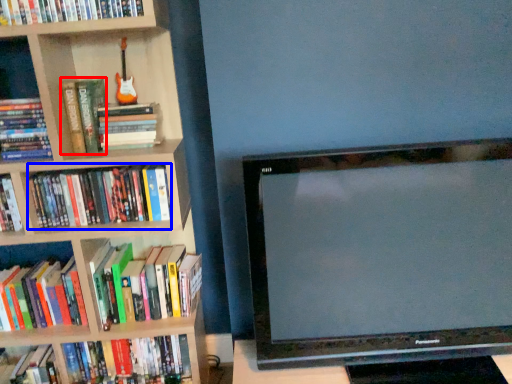
Question: Which object is further to the camera taking this photo, paperback book (highlighted by a red box) or book (highlighted by a blue box)?

Choices:
 (A) paperback book
 (B) book

Answer: (B)